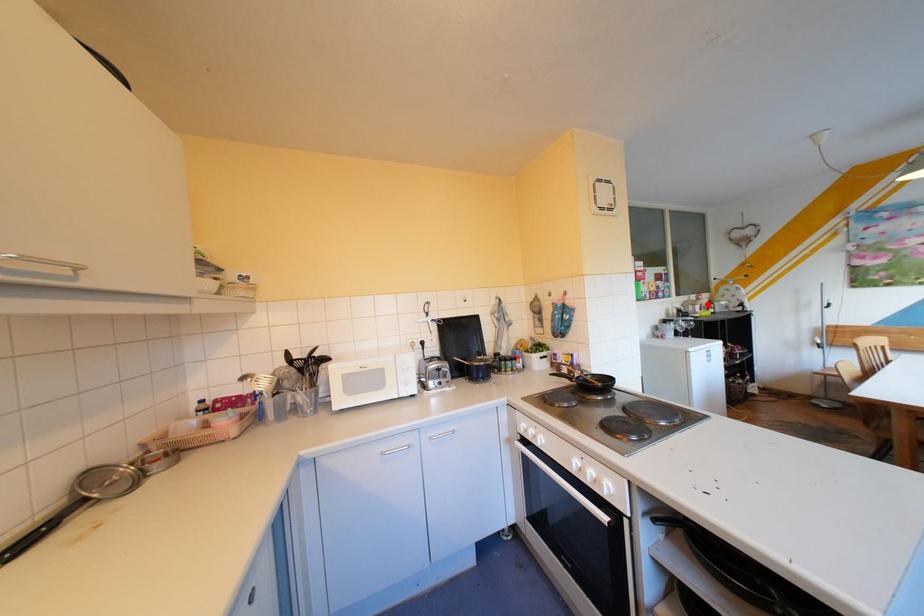
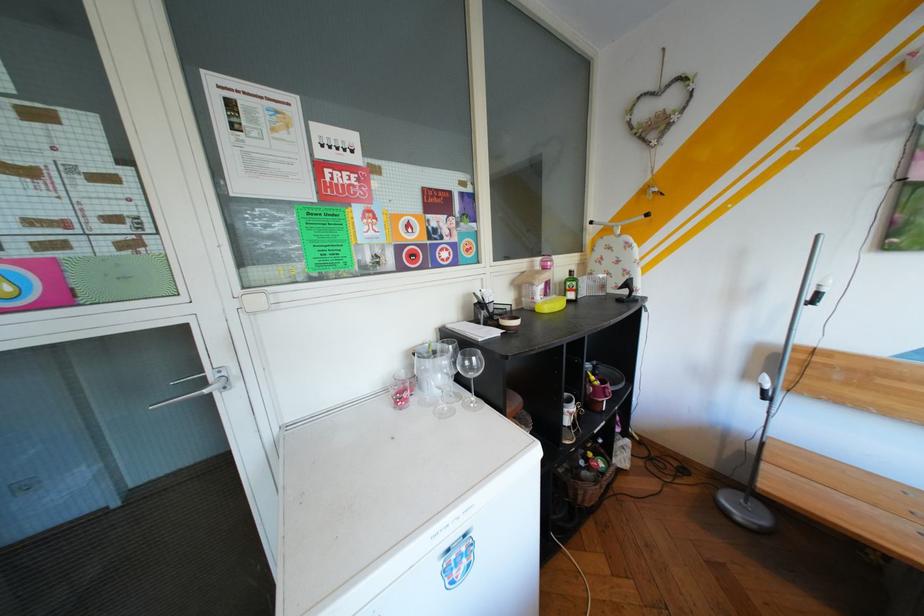
The point at the highlighted location is marked in the first image. Where is the corresponding point in the second image?

(545, 284)